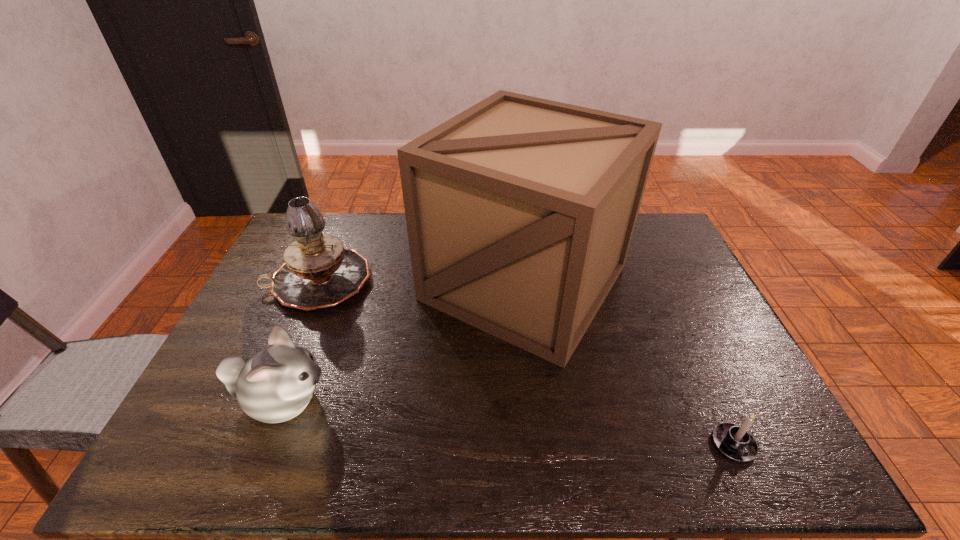
You are a GUI agent. You are given a task and a screenshot of the screen. Output one action in this format:
    pyautogui.click(x=<x>, y=<y>)
    Task: Click on the oil lamp at the far edge
    This screenshot has height=540, width=960.
    Given the screenshot: What is the action you would take?
    pyautogui.click(x=318, y=272)

At what (x,y) coordinates should I click in order to perform the action: click on object that is at the near edge. Please return your answer as a coordinate pair (x, y). Looking at the image, I should click on (735, 442).

You are a GUI agent. You are given a task and a screenshot of the screen. Output one action in this format:
    pyautogui.click(x=<x>, y=<y>)
    Task: Click on the oil lamp that is at the left edge
    This screenshot has height=540, width=960.
    Given the screenshot: What is the action you would take?
    pyautogui.click(x=318, y=272)

This screenshot has width=960, height=540. In order to click on hamster positioned at the left edge in this screenshot , I will do `click(276, 384)`.

Find the location of a particular element. object at the right edge is located at coordinates (735, 442).

Image resolution: width=960 pixels, height=540 pixels. Identify the location of object positioned at the far left corner. (318, 272).

Where is `object that is at the near right corner`? This screenshot has height=540, width=960. object that is at the near right corner is located at coordinates coord(735,442).

This screenshot has width=960, height=540. I want to click on vacant region at the far edge, so click(366, 234).

Image resolution: width=960 pixels, height=540 pixels. In the image, there is a desktop. Identify the location of vacant space at the near edge. (624, 454).

This screenshot has width=960, height=540. What are the coordinates of `vacant space at the left edge of the desktop` in the screenshot? It's located at (210, 374).